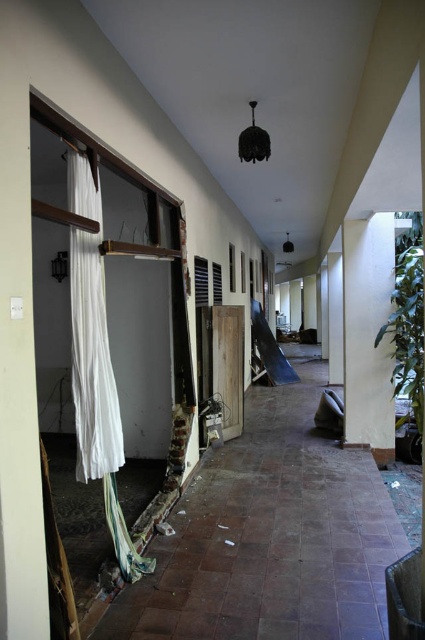
Which is below, white fabric curtain at left or green textured pillar at right?

white fabric curtain at left is below.

Is point (101, 202) farther from camera compared to point (368, 412)?

That is False.

Who is more forward, (91, 332) or (390, 273)?

Positioned in front is point (91, 332).

Find the location of a particular element. white fabric curtain at left is located at coordinates (96, 365).